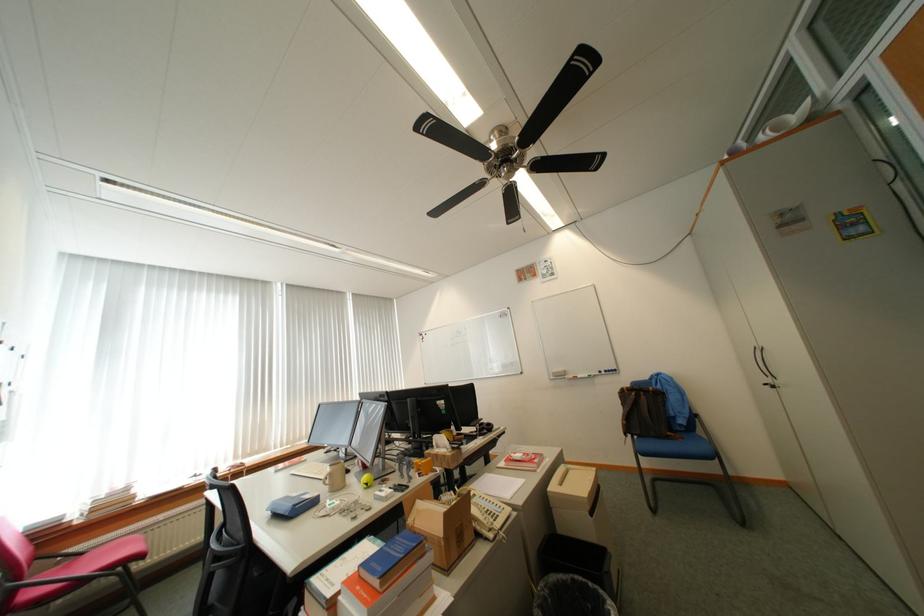
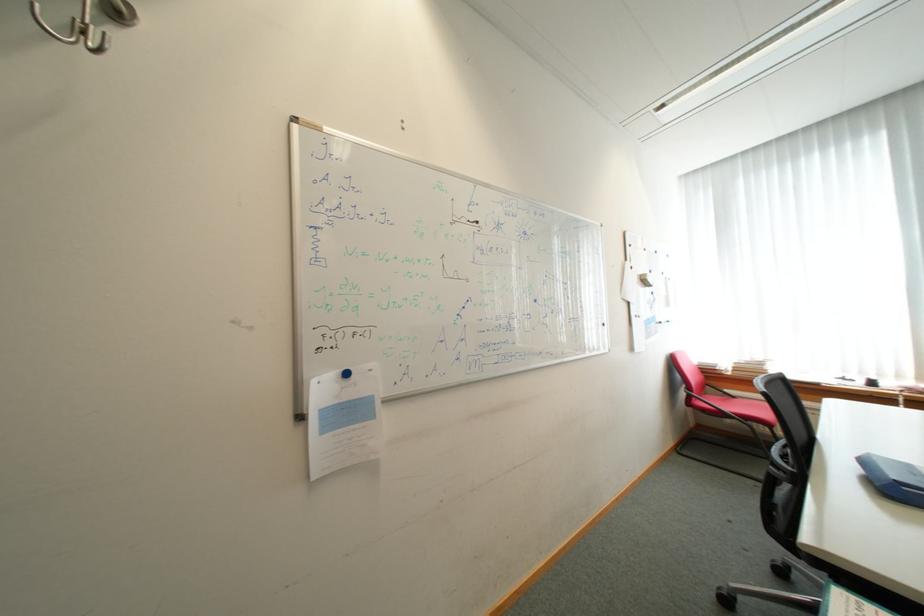
Where in the second image is the point corresponding to the point at 91,554 from the first image?

(743, 398)